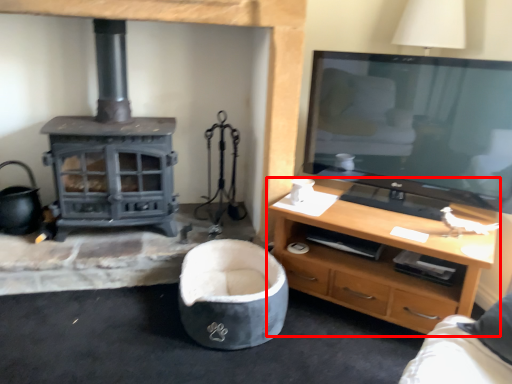
Question: Where is desk (annotated by the red box) located in relation to bean bag chair in the image?

Choices:
 (A) right
 (B) left

Answer: (A)